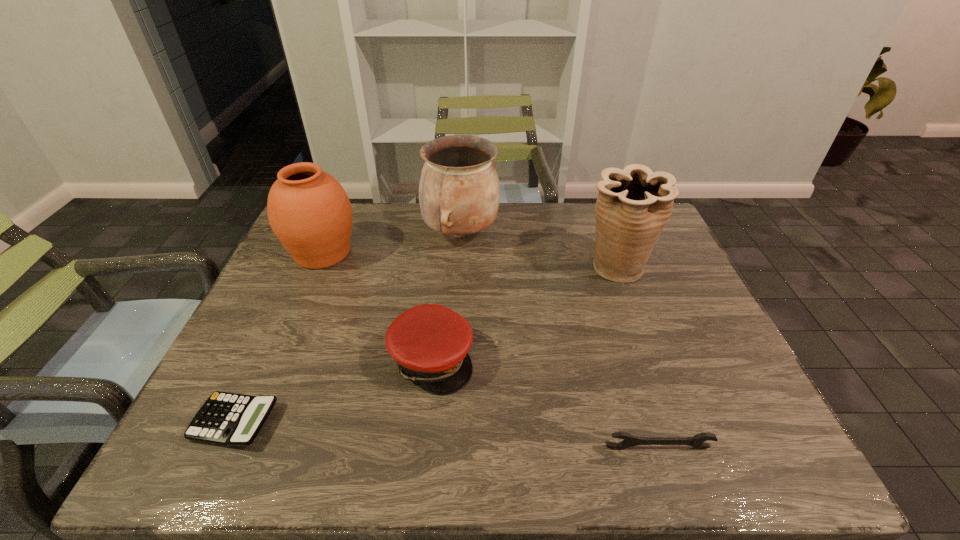
Where is `vacant space situated 0.170m on the right of the calculator`? This screenshot has height=540, width=960. vacant space situated 0.170m on the right of the calculator is located at coordinates (357, 422).

At what (x,y) coordinates should I click in order to perform the action: click on wrench at the near edge. Please return your answer as a coordinate pair (x, y). Looking at the image, I should click on (697, 441).

At what (x,y) coordinates should I click in order to perform the action: click on calculator that is at the near edge. Please return your answer as a coordinate pair (x, y). The width and height of the screenshot is (960, 540). Looking at the image, I should click on (230, 419).

Where is `urn located in the left edge section of the desktop`? The height and width of the screenshot is (540, 960). urn located in the left edge section of the desktop is located at coordinates (310, 213).

Locate an element on the screen. The width and height of the screenshot is (960, 540). calculator at the left edge is located at coordinates (230, 419).

Where is `urn positioned at the right edge`? This screenshot has height=540, width=960. urn positioned at the right edge is located at coordinates (634, 204).

Locate an element on the screen. The height and width of the screenshot is (540, 960). wrench that is at the right edge is located at coordinates (697, 441).

Image resolution: width=960 pixels, height=540 pixels. What are the coordinates of `object present at the far left corner` in the screenshot? It's located at (310, 213).

Image resolution: width=960 pixels, height=540 pixels. I want to click on object located in the near left corner section of the desktop, so click(230, 419).

In order to click on object that is at the near right corner in this screenshot , I will do `click(697, 441)`.